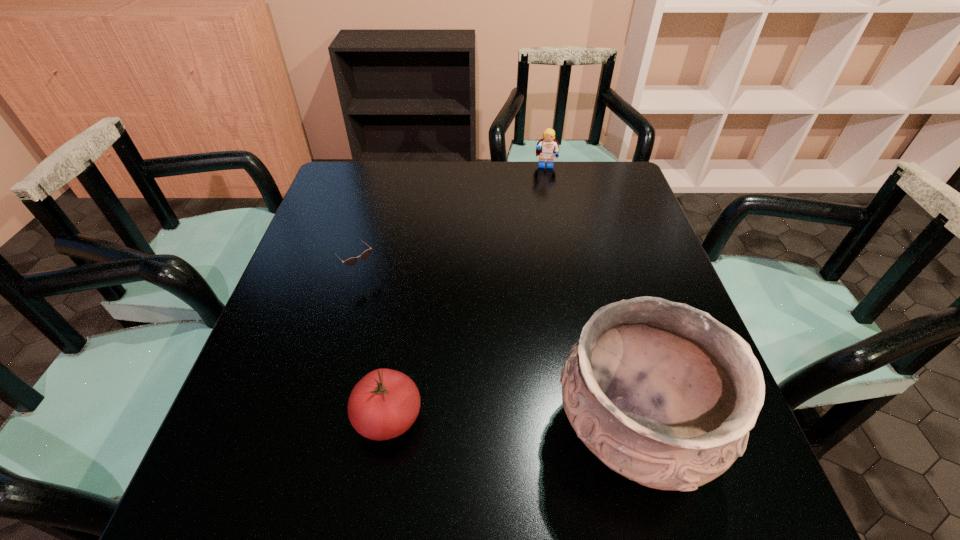
At what (x,y) coordinates should I click in order to perform the action: click on free point between the sunglasses and the pottery. Please return your answer as a coordinate pair (x, y). The image size is (960, 540). Looking at the image, I should click on (498, 353).

This screenshot has height=540, width=960. I want to click on free space between the second farthest object and the tomato, so point(376,346).

The height and width of the screenshot is (540, 960). What are the coordinates of `free space between the shortest object and the tomato` in the screenshot? It's located at (376, 346).

Find the location of a particular element. vacant region between the pottery and the sunglasses is located at coordinates 498,353.

The image size is (960, 540). I want to click on object that stands as the third closest to the Lego, so click(384, 404).

In order to click on the closest object to the sunglasses in this screenshot , I will do `click(384, 404)`.

Identify the location of vacant region that satisfies the following two spatial constraints: 1. on the back side of the tomato; 2. on the left side of the farthest object. (428, 166).

You are a GUI agent. You are given a task and a screenshot of the screen. Output one action in this format:
    pyautogui.click(x=<x>, y=<y>)
    Task: Click on the free space that satisfies the following two spatial constraints: 1. on the front side of the tomato; 2. on the left side of the shortest object
    
    Given the screenshot: What is the action you would take?
    pyautogui.click(x=325, y=417)